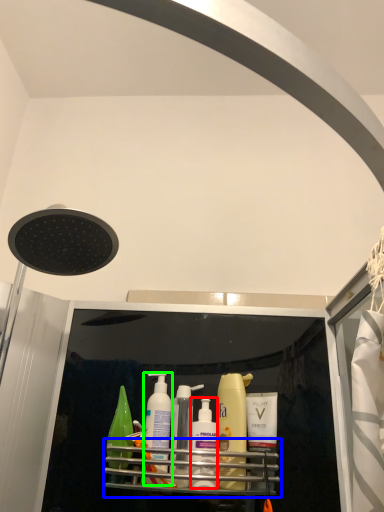
Question: Which is nearer to the toiletry (highlighted by a red box)? shelf (highlighted by a blue box) or cleaning product (highlighted by a green box).

Choices:
 (A) shelf
 (B) cleaning product

Answer: (A)